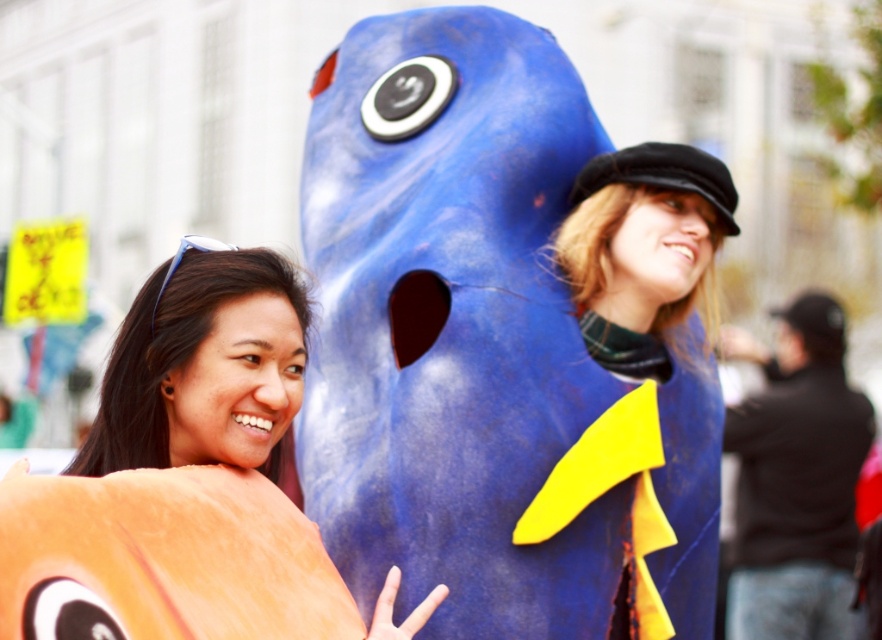
Question: Observing the image, what is the correct spatial positioning of matte orange plush at left in reference to matte blue costume at center?

Choices:
 (A) below
 (B) above

Answer: (A)

Question: Does matte orange plush at left appear under matte blue costume at center?

Choices:
 (A) yes
 (B) no

Answer: (A)

Question: Which point is closer to the camera?

Choices:
 (A) matte orange plush at left
 (B) matte blue costume at center

Answer: (A)

Question: Can you confirm if matte orange plush at left is bigger than matte blue costume at center?

Choices:
 (A) yes
 (B) no

Answer: (A)